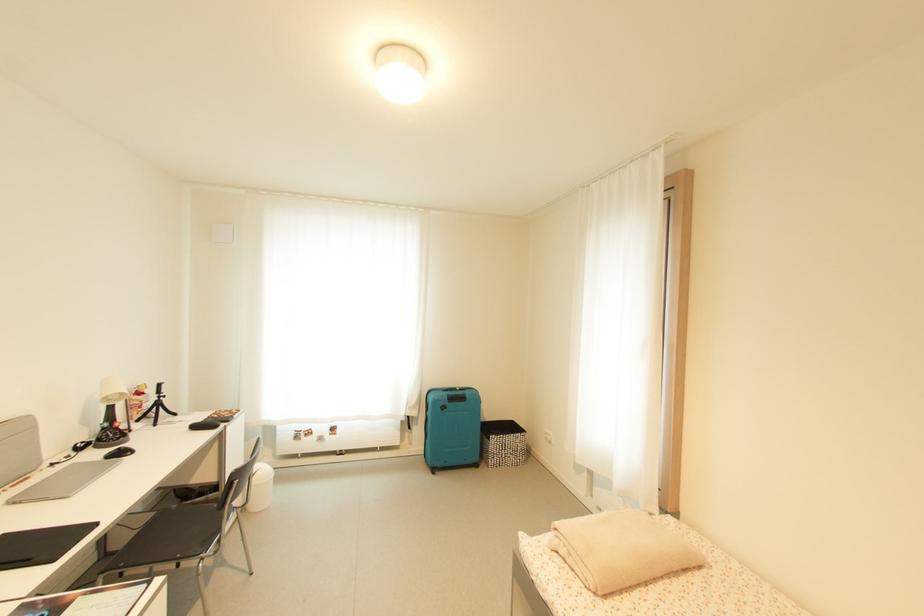
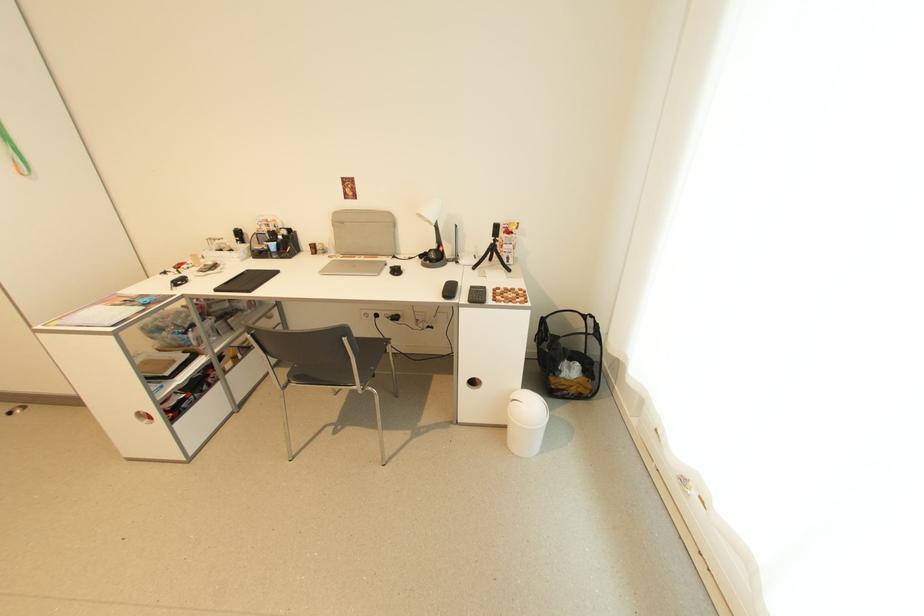
Locate, in the second image, the point that corresponds to point 163,395 in the first image.

(497, 238)